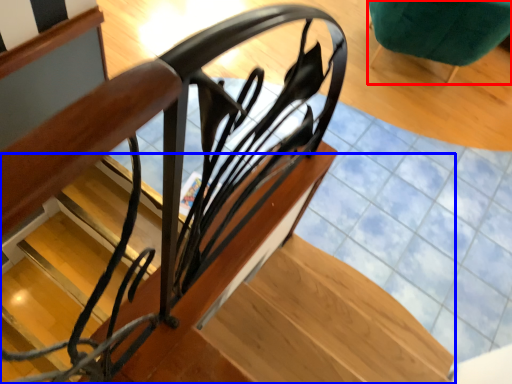
Question: Which object appears farthest to the camera in this image, furniture (highlighted by a red box) or stairs (highlighted by a blue box)?

Choices:
 (A) furniture
 (B) stairs

Answer: (A)